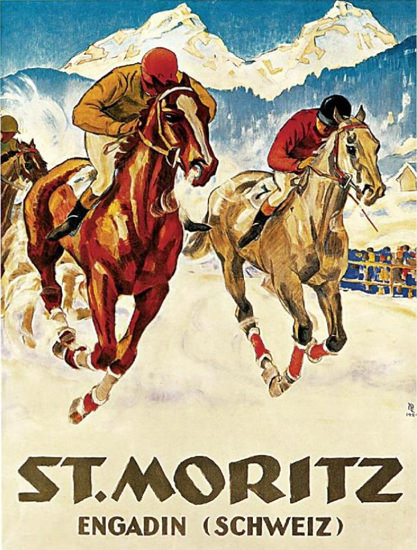
This screenshot has width=417, height=550. I want to click on dust, so [x=13, y=293].